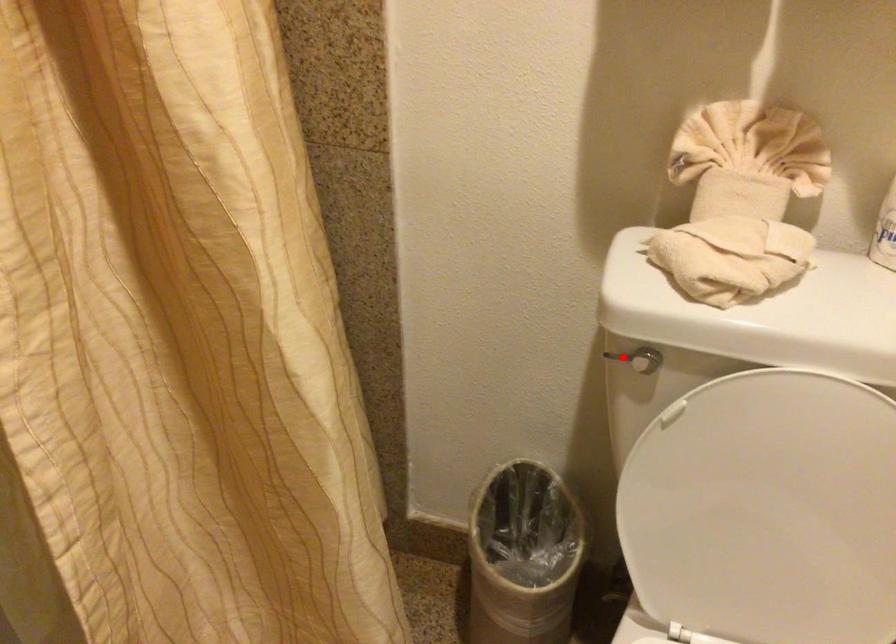
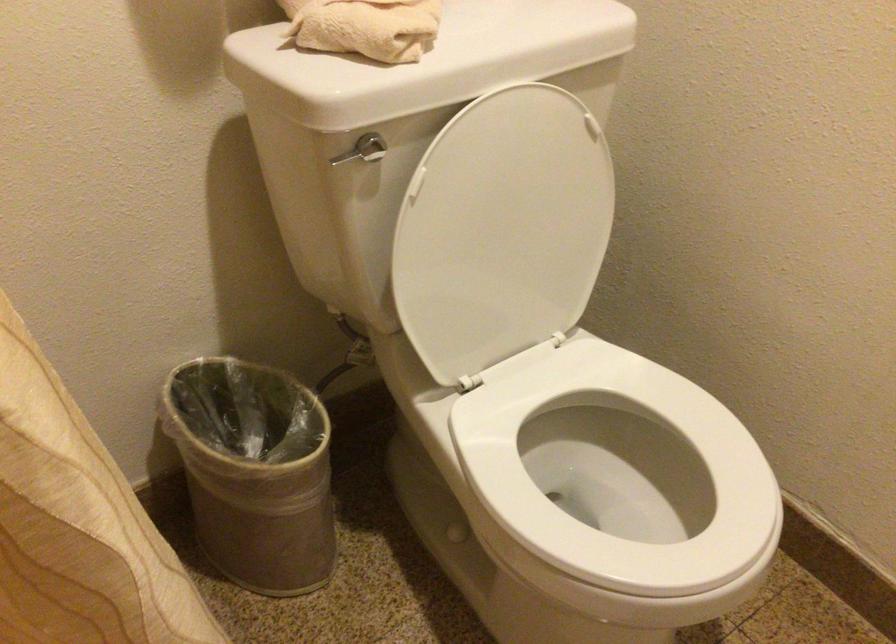
Where in the second image is the point corresponding to the highlighted location from the first image?

(348, 155)